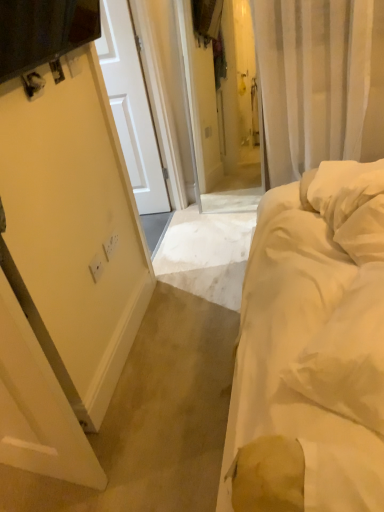
Question: Is point coord(365,480) closer or farther from the camera than point coord(109,236)?

Choices:
 (A) farther
 (B) closer

Answer: (B)

Question: From the image's perspective, is white soft bed at right above or below white plastic electric outlet at left?

Choices:
 (A) above
 (B) below

Answer: (B)

Question: Looking at the image, does white soft bed at right seem bigger or smaller compared to white plastic electric outlet at left?

Choices:
 (A) small
 (B) big

Answer: (B)

Question: Visually, is white plastic electric outlet at left positioned to the left or to the right of white soft bed at right?

Choices:
 (A) left
 (B) right

Answer: (A)

Question: Is white plastic electric outlet at left wider or thinner than white soft bed at right?

Choices:
 (A) wide
 (B) thin

Answer: (B)

Question: In the image, is white plastic electric outlet at left positioned in front of or behind white soft bed at right?

Choices:
 (A) front
 (B) behind

Answer: (B)

Question: Is white plastic electric outlet at left bigger or smaller than white soft bed at right?

Choices:
 (A) small
 (B) big

Answer: (A)